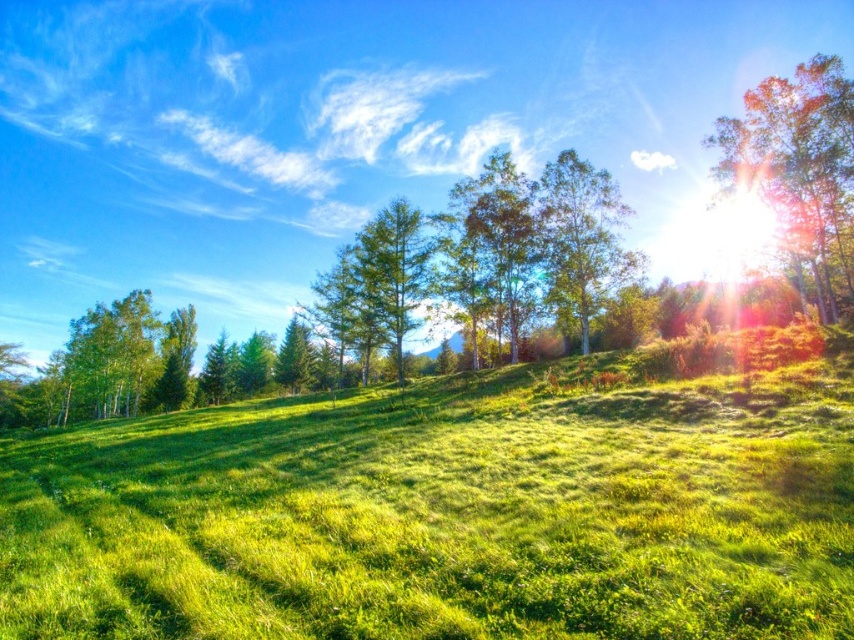
You are standing in the middle of the grassy field looking towards the cluster of trees. There are two points marked in the image. The first point is at coordinate point (63, 483) and the second is at point (548, 164). Which point is closer to you?

Point (63, 483) is closer to the camera than point (548, 164), so the first point is closer to you.

You are standing on the green soft grass at center and want to reach the green leafy tree at upper right. If your walking speed is 1.5 meters per second, how many seconds will it take you to reach the tree?

The distance between the green soft grass at center and the green leafy tree at upper right is 34.06 meters. At a walking speed of 1.5 meters per second, it would take approximately 22.7 seconds to reach the tree.

You are standing at the origin point in the image. Which direction should you move to reach the green soft grass at center?

The green soft grass at center is located at point 0.798 on the x axis and 0.526 on the y axis, so you should move towards the right and slightly upwards to reach it.